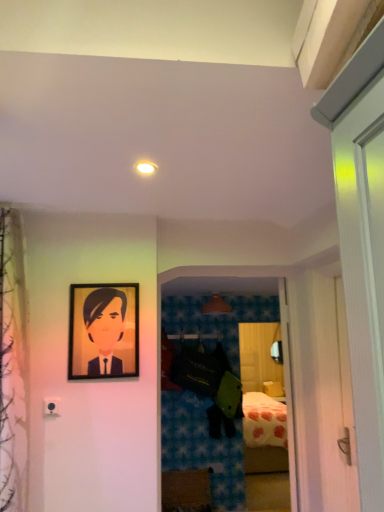
Question: Is matte white light fixture at upper center positioned beyond the bounds of matte black portrait at upper left?

Choices:
 (A) yes
 (B) no

Answer: (A)

Question: Is matte white light fixture at upper center to the right of matte black portrait at upper left from the viewer's perspective?

Choices:
 (A) no
 (B) yes

Answer: (B)

Question: Can you confirm if matte white light fixture at upper center is taller than matte black portrait at upper left?

Choices:
 (A) yes
 (B) no

Answer: (B)

Question: Does matte white light fixture at upper center have a lesser width compared to matte black portrait at upper left?

Choices:
 (A) yes
 (B) no

Answer: (B)

Question: Is matte white light fixture at upper center shorter than matte black portrait at upper left?

Choices:
 (A) yes
 (B) no

Answer: (A)

Question: Does matte white light fixture at upper center lie behind matte black portrait at upper left?

Choices:
 (A) yes
 (B) no

Answer: (B)

Question: Could you tell me if matte black portrait at upper left is facing wooden chest of drawers at lower center?

Choices:
 (A) yes
 (B) no

Answer: (B)

Question: Does matte black portrait at upper left lie in front of wooden chest of drawers at lower center?

Choices:
 (A) no
 (B) yes

Answer: (B)

Question: Is matte black portrait at upper left smaller than wooden chest of drawers at lower center?

Choices:
 (A) yes
 (B) no

Answer: (A)

Question: Can you confirm if matte black portrait at upper left is thinner than wooden chest of drawers at lower center?

Choices:
 (A) yes
 (B) no

Answer: (A)

Question: Is wooden chest of drawers at lower center at the back of matte black portrait at upper left?

Choices:
 (A) yes
 (B) no

Answer: (B)

Question: Considering the relative sizes of matte black portrait at upper left and wooden chest of drawers at lower center in the image provided, is matte black portrait at upper left shorter than wooden chest of drawers at lower center?

Choices:
 (A) no
 (B) yes

Answer: (A)

Question: Is wooden chest of drawers at lower center turned away from matte brown lampshade at center?

Choices:
 (A) yes
 (B) no

Answer: (B)